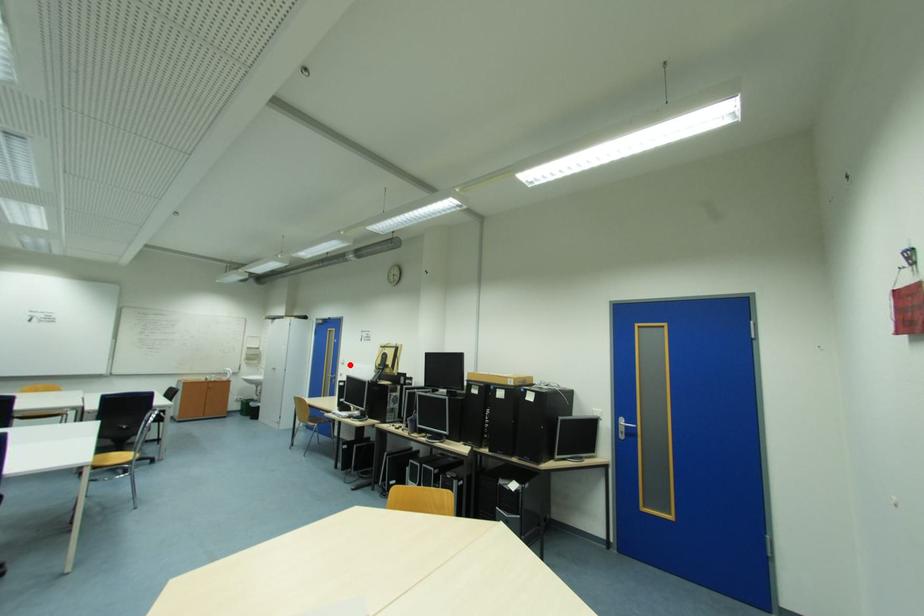
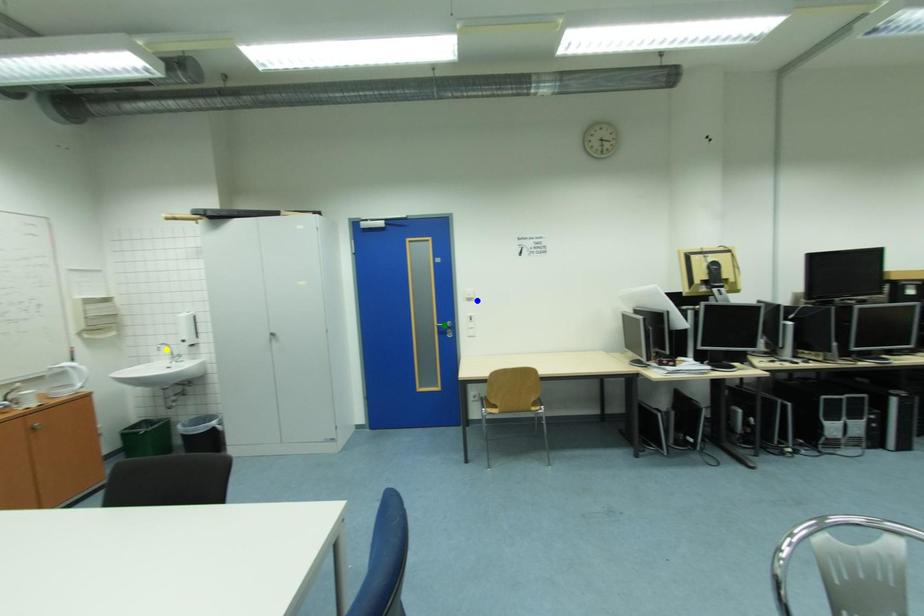
Question: I am providing you with two images of the same scene from different viewpoints. A red point is marked on the first image. You are given multiple points on the second image. In image 2, which mark is for the same physical point as the one in image 1?

Choices:
 (A) yellow point
 (B) green point
 (C) blue point

Answer: (C)